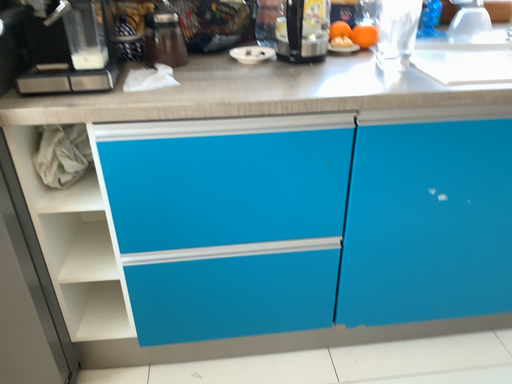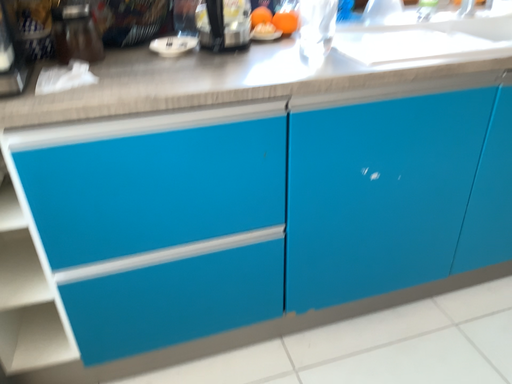
Question: How did the camera likely rotate when shooting the video?

Choices:
 (A) rotated left
 (B) rotated right

Answer: (B)